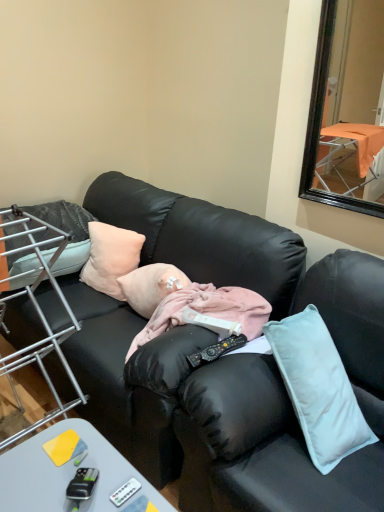
At what (x,y) coordinates should I click in order to perform the action: click on free space to the back side of white plastic remote control at lower center, the second remote control positioned from the top. Please return your answer as a coordinate pair (x, y). The image size is (384, 512). Looking at the image, I should click on (107, 459).